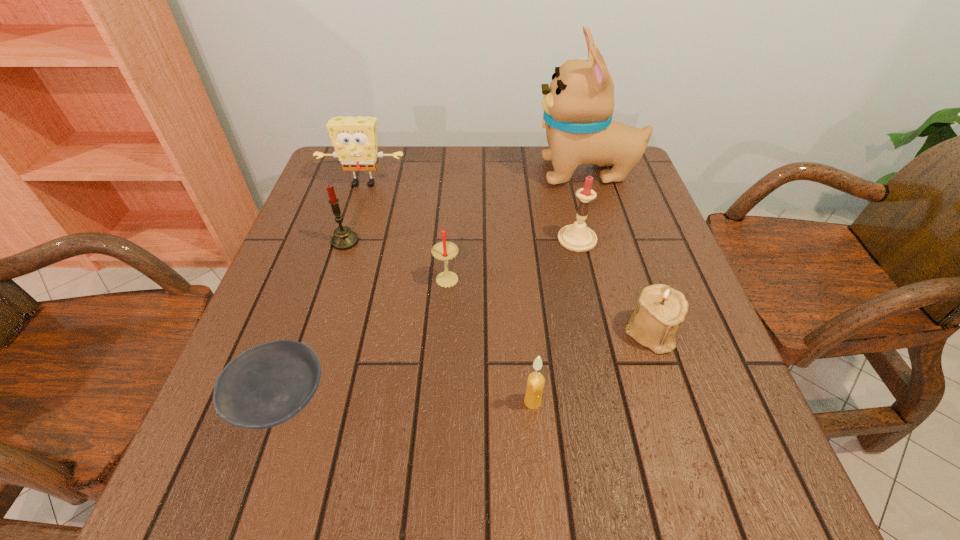
Where is `free spot between the leftmost candle and the fourth nearest object`? This screenshot has width=960, height=540. free spot between the leftmost candle and the fourth nearest object is located at coordinates (396, 259).

I want to click on unoccupied area between the rightmost candle and the leftmost candle, so click(461, 240).

This screenshot has width=960, height=540. What are the coordinates of `blank region between the bowl and the leftmost candle` in the screenshot? It's located at (313, 321).

The width and height of the screenshot is (960, 540). Identify the location of empty location between the second candle from left to right and the leftmost candle. (396, 259).

Where is `unoccupied position between the candle_holder and the leftmost candle`? unoccupied position between the candle_holder and the leftmost candle is located at coordinates (498, 287).

Identify which object is the fourth nearest to the candle_holder. Please provide its 2D coordinates. Your answer should be formatted as a tuple, i.e. [(x, y)], where the tuple contains the x and y coordinates of a point satisfying the conditions above.

[(578, 104)]

The width and height of the screenshot is (960, 540). I want to click on object that stands as the fourth closest to the second candle from left to right, so click(x=536, y=381).

Locate which candle ranks third in proximity to the rightmost candle. Please provide its 2D coordinates. Your answer should be formatted as a tuple, i.e. [(x, y)], where the tuple contains the x and y coordinates of a point satisfying the conditions above.

[(343, 239)]

Locate an element on the screen. candle that is the third nearest to the fifth farthest object is located at coordinates (536, 381).

The height and width of the screenshot is (540, 960). What are the coordinates of `vacant position in the image that satisfies the following two spatial constraints: 1. on the front side of the bowl; 2. on the left side of the fourth object from right to left` in the screenshot? It's located at (281, 402).